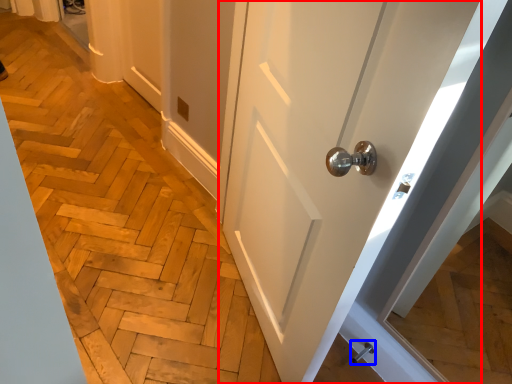
Question: Among these objects, which one is nearest to the camera, door (highlighted by a red box) or door handle (highlighted by a blue box)?

Choices:
 (A) door
 (B) door handle

Answer: (A)